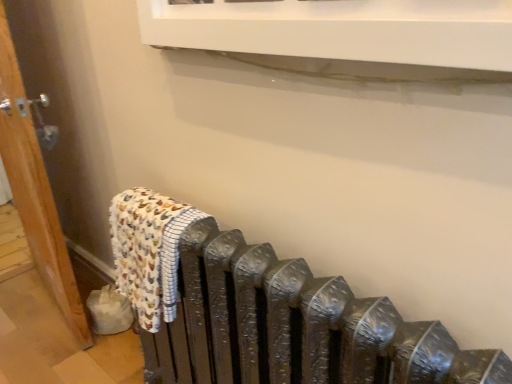
Question: Should I look upward or downward to see printed cotton bath towel at left?

Choices:
 (A) down
 (B) up

Answer: (A)

Question: Considering the relative sizes of printed cotton bath towel at left and wooden door at left in the image provided, is printed cotton bath towel at left wider than wooden door at left?

Choices:
 (A) yes
 (B) no

Answer: (B)

Question: Does printed cotton bath towel at left have a larger size compared to wooden door at left?

Choices:
 (A) yes
 (B) no

Answer: (B)

Question: From the image's perspective, is printed cotton bath towel at left located above wooden door at left?

Choices:
 (A) no
 (B) yes

Answer: (A)

Question: Does printed cotton bath towel at left appear on the left side of wooden door at left?

Choices:
 (A) no
 (B) yes

Answer: (A)

Question: Are printed cotton bath towel at left and wooden door at left far apart?

Choices:
 (A) yes
 (B) no

Answer: (B)

Question: From a real-world perspective, is printed cotton bath towel at left located beneath wooden door at left?

Choices:
 (A) yes
 (B) no

Answer: (A)

Question: Are wooden door at left and printed cotton bath towel at left making contact?

Choices:
 (A) no
 (B) yes

Answer: (A)

Question: Is wooden door at left far away from printed cotton bath towel at left?

Choices:
 (A) yes
 (B) no

Answer: (B)

Question: Is wooden door at left closer to camera compared to printed cotton bath towel at left?

Choices:
 (A) no
 (B) yes

Answer: (A)

Question: Does wooden door at left have a lesser height compared to printed cotton bath towel at left?

Choices:
 (A) no
 (B) yes

Answer: (A)

Question: Is wooden door at left positioned with its back to printed cotton bath towel at left?

Choices:
 (A) yes
 (B) no

Answer: (B)

Question: Considering the relative sizes of wooden door at left and printed cotton bath towel at left in the image provided, is wooden door at left smaller than printed cotton bath towel at left?

Choices:
 (A) no
 (B) yes

Answer: (A)

Question: Is point (11, 175) closer or farther from the camera than point (144, 218)?

Choices:
 (A) closer
 (B) farther

Answer: (B)